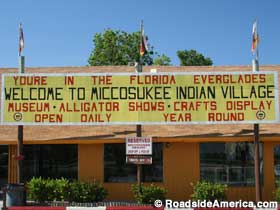
At what (x,y) coordinates should I click in order to perform the action: click on trashcan liner. Please return your answer as a coordinate pair (x, y). This screenshot has height=210, width=280. Looking at the image, I should click on (12, 185).